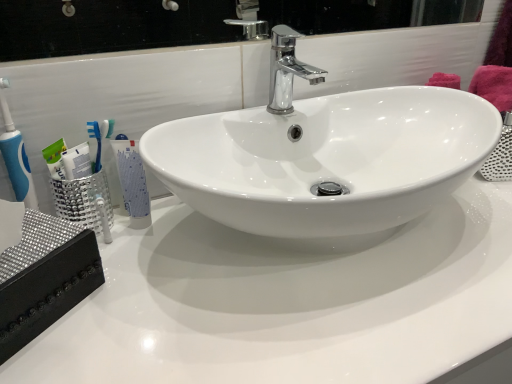
Question: Which is correct: white glossy countertop at center is inside chrome/metallic faucet at center, or outside of it?

Choices:
 (A) inside
 (B) outside

Answer: (B)

Question: Considering the positions of point (471, 332) and point (272, 112), is point (471, 332) closer or farther from the camera than point (272, 112)?

Choices:
 (A) closer
 (B) farther

Answer: (A)

Question: Which is nearer to the chrome/metallic faucet at center?

Choices:
 (A) white glossy tube at left
 (B) white glossy countertop at center

Answer: (A)

Question: Which is farther from the white glossy tube at left?

Choices:
 (A) white glossy countertop at center
 (B) chrome/metallic faucet at center

Answer: (B)